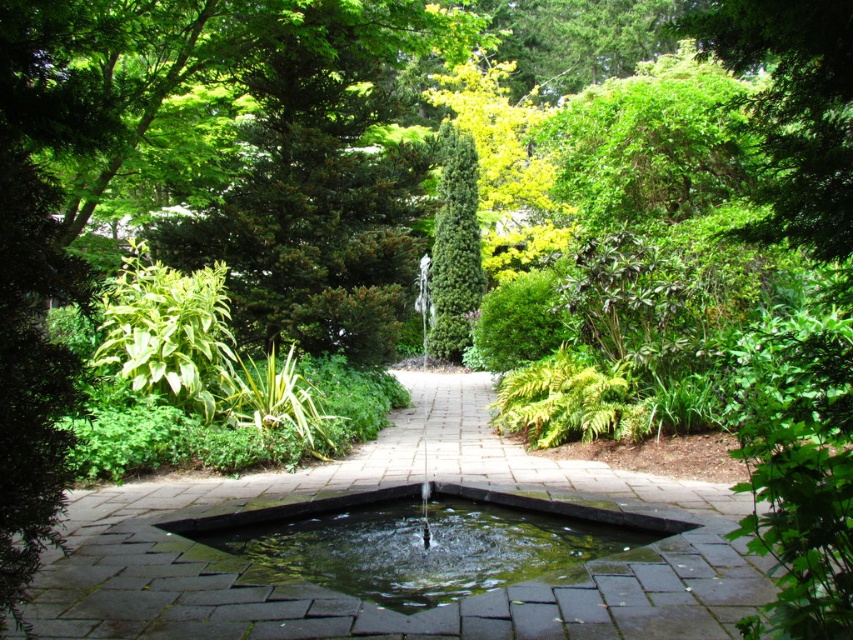
You are standing at the edge of the garden and see the point marked at coordinates point (x=422, y=541). According to the image, where is this point located?

The point (x=422, y=541) is located on the green mossy water at center.

You are a gardener planning to place a new decorative statue that requires a flat surface. Which object between the green mossy water at center and the green leafy bush at upper left would be more suitable for placing the statue?

The green mossy water at center is not as tall as the green leafy bush at upper left, so the statue should be placed on the green leafy bush at upper left since it is taller and likely provides a stable flat surface.